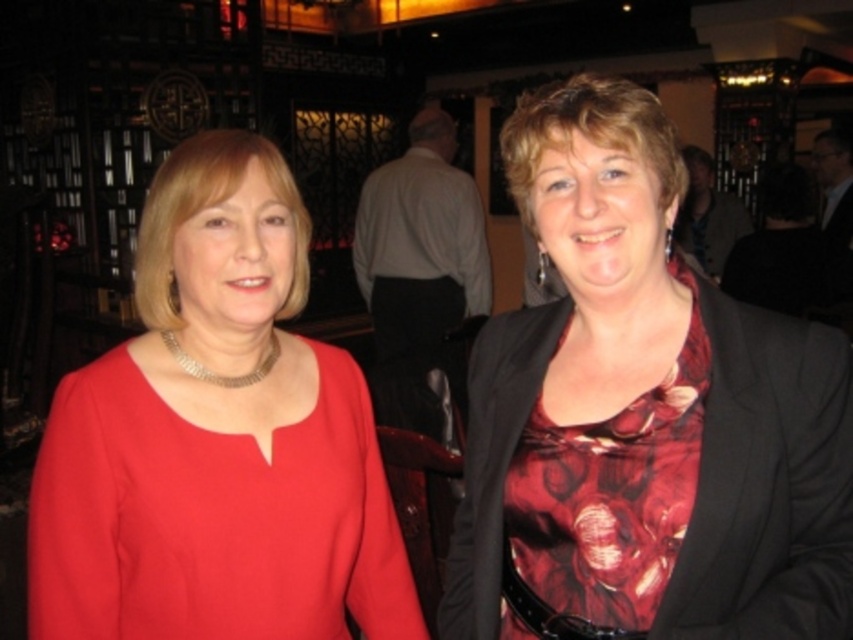
Does floral silk blouse at center have a greater width compared to floral satin dress at center?

Indeed, floral silk blouse at center has a greater width compared to floral satin dress at center.

Is floral silk blouse at center taller than floral satin dress at center?

Indeed, floral silk blouse at center has a greater height compared to floral satin dress at center.

Does point (619, 445) come behind point (532, 422)?

No, it is not.

Image resolution: width=853 pixels, height=640 pixels. I want to click on floral silk blouse at center, so click(645, 412).

Who is lower down, matte gold necklace at center or floral satin dress at center?

Positioned lower is floral satin dress at center.

Is matte gold necklace at center wider than floral satin dress at center?

Yes.

The height and width of the screenshot is (640, 853). What are the coordinates of `matte gold necklace at center` in the screenshot? It's located at (216, 440).

I want to click on matte gold necklace at center, so click(x=216, y=440).

Between floral silk blouse at center and matte gold necklace at center, which one appears on the right side from the viewer's perspective?

From the viewer's perspective, floral silk blouse at center appears more on the right side.

Is floral silk blouse at center positioned behind matte gold necklace at center?

No.

Is point (645, 401) farther from camera compared to point (126, 608)?

No, it is in front of (126, 608).

At what (x,y) coordinates should I click in order to perform the action: click on floral silk blouse at center. Please return your answer as a coordinate pair (x, y). Image resolution: width=853 pixels, height=640 pixels. Looking at the image, I should click on point(645,412).